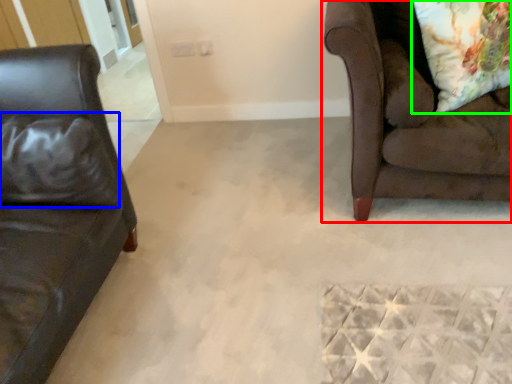
Question: Estimate the real-world distances between objects in this image. Which object is closer to studio couch (highlighted by a red box), pillow (highlighted by a blue box) or throw pillow (highlighted by a green box)?

Choices:
 (A) pillow
 (B) throw pillow

Answer: (B)